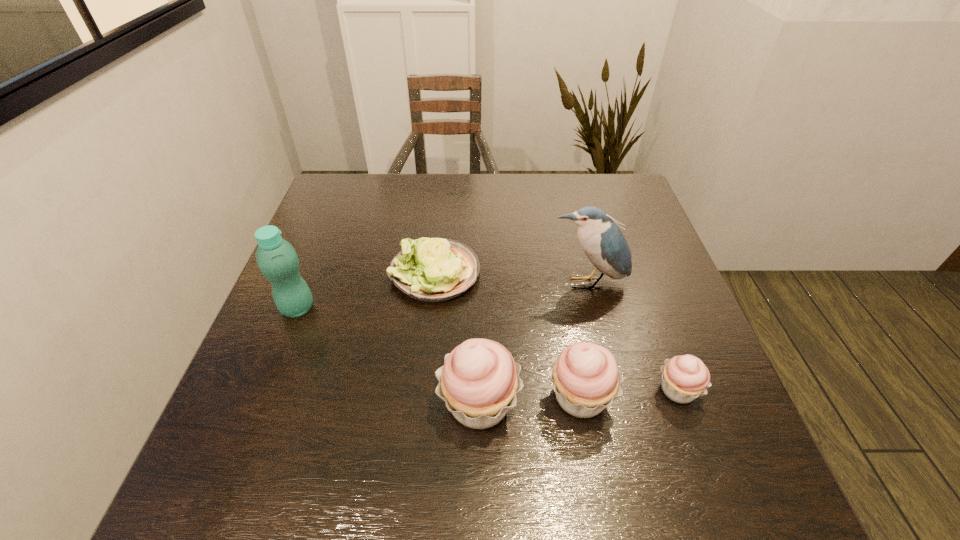
The width and height of the screenshot is (960, 540). I want to click on free point that keeps the cupcakes evenly spaced on the left, so click(x=376, y=409).